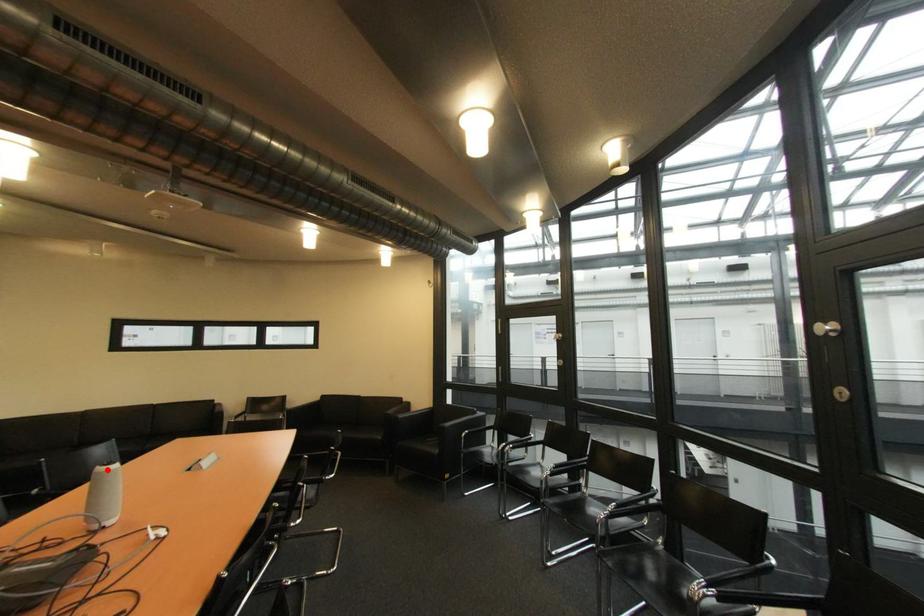
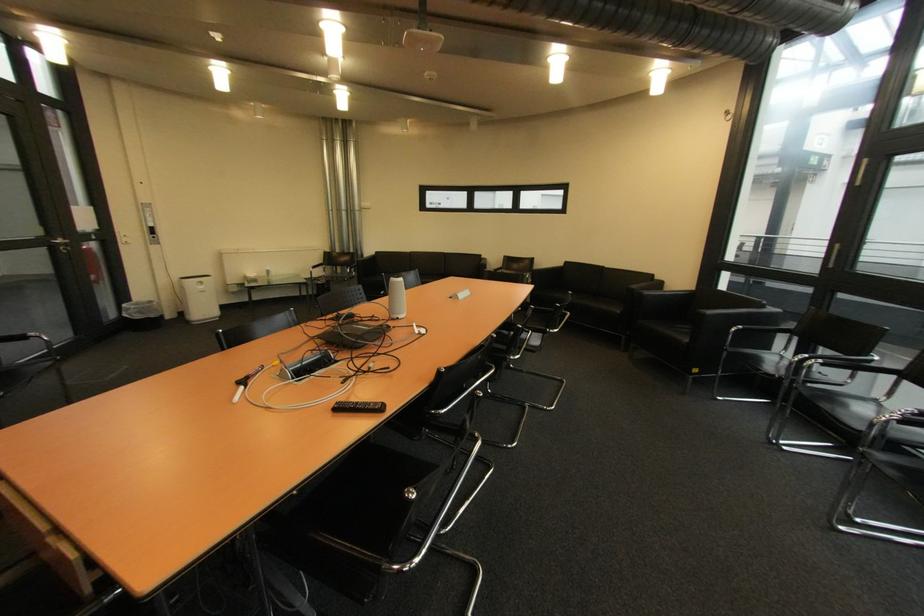
Where in the second image is the point corresponding to the highlighted location from the first image?

(400, 281)